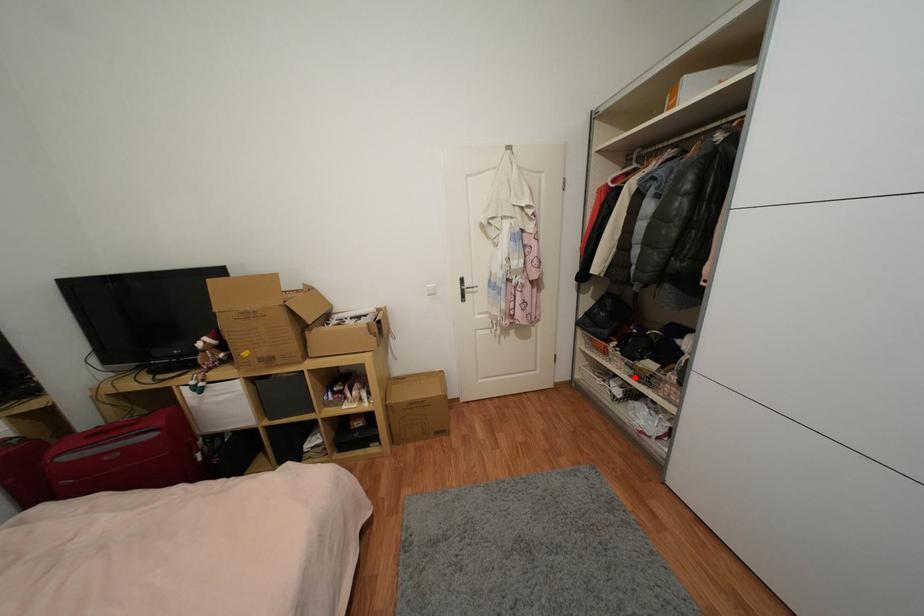
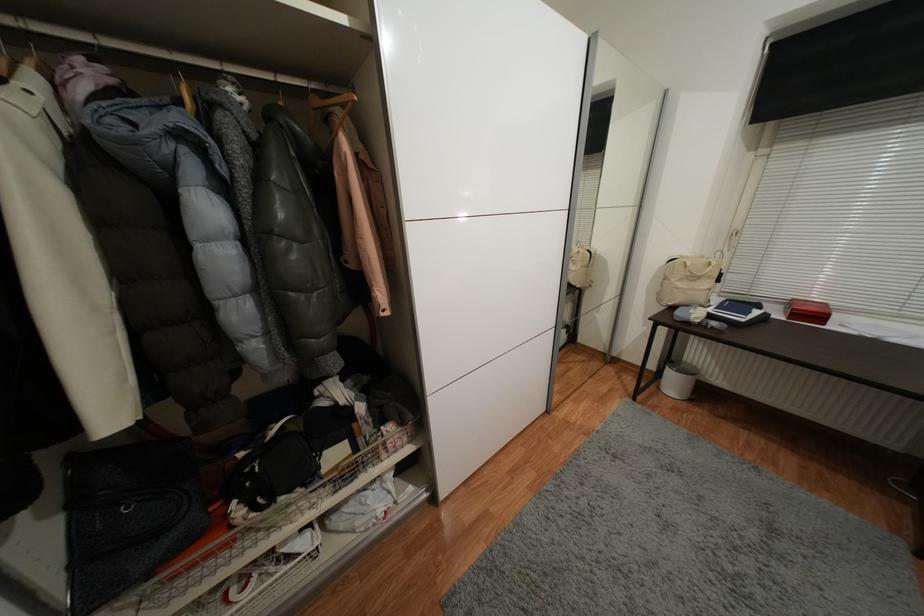
In the second image, find the point that corresponds to the highlighted location in the first image.

(342, 493)